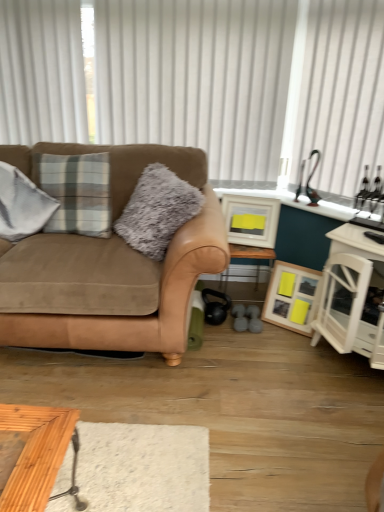
This screenshot has width=384, height=512. Describe the element at coordinates (157, 210) in the screenshot. I see `fuzzy gray pillow at center` at that location.

Measure the distance between point (270, 201) and camera.

The distance of point (270, 201) from camera is 2.45 meters.

Identify the location of matte white picture frame at center, arranged as the first picture frame when viewed from the top. (251, 220).

Describe the element at coordinates (350, 297) in the screenshot. Image resolution: width=384 pixels, height=512 pixels. I see `white wood cabinet at right` at that location.

The width and height of the screenshot is (384, 512). Identify the location of white vertical blinds at upper center, which is the 2th curtain in right-to-left order. (196, 78).

Can you confirm if suede brown couch at left is positioned to the right of matte white picture frame at center, arranged as the second picture frame when ordered from the bottom?

No.

Is the depth of suede brown couch at left greater than that of matte white picture frame at center, arranged as the second picture frame when ordered from the bottom?

That is False.

Considering the relative sizes of suede brown couch at left and matte white picture frame at center, arranged as the second picture frame when ordered from the bottom, in the image provided, is suede brown couch at left shorter than matte white picture frame at center, arranged as the second picture frame when ordered from the bottom,?

Incorrect, the height of suede brown couch at left does not fall short of that of matte white picture frame at center, arranged as the second picture frame when ordered from the bottom.

Between point (152, 290) and point (250, 199), which one is positioned in front?

Positioned in front is point (152, 290).

Between fuzzy gray pillow at center and wooden table at center, which one has larger size?

fuzzy gray pillow at center.

From the image's perspective, is fuzzy gray pillow at center located above or below wooden table at center?

Clearly, from the image's perspective, fuzzy gray pillow at center is above wooden table at center.

From the picture: Considering the relative positions of fuzzy gray pillow at center and wooden table at center in the image provided, is fuzzy gray pillow at center to the left of wooden table at center from the viewer's perspective?

Indeed, fuzzy gray pillow at center is positioned on the left side of wooden table at center.

In the scene shown: Is fuzzy gray pillow at center oriented away from wooden table at center?

Yes, wooden table at center is at the back of fuzzy gray pillow at center.

Looking at this image, does wooden table at center have a lesser width compared to white vertical blinds at upper center, which is the 2th curtain in right-to-left order?

Incorrect, the width of wooden table at center is not less than that of white vertical blinds at upper center, which is the 2th curtain in right-to-left order.

From a real-world perspective, is wooden table at center above or below white vertical blinds at upper center, which appears as the first curtain when viewed from the left?

Clearly, from a real-world perspective, wooden table at center is below white vertical blinds at upper center, which appears as the first curtain when viewed from the left.

Between wooden table at center and white vertical blinds at upper center, which is the 2th curtain in right-to-left order, which one has smaller size?

wooden table at center.

What's the angular difference between wooden table at center and white vertical blinds at upper center, which appears as the first curtain when viewed from the left,'s facing directions?

2.52 degrees.

From the image's perspective, count 1st curtains upward from the matte white picture frame at center, arranged as the first picture frame when viewed from the top, and point to it. Please provide its 2D coordinates.

[(342, 94)]

From the image's perspective, relative to matte white picture frame at center, arranged as the first picture frame when viewed from the top, is white sheer curtain at upper right, marked as the second curtain in a left-to-right arrangement, above or below?

Based on their image positions, white sheer curtain at upper right, marked as the second curtain in a left-to-right arrangement, is located above matte white picture frame at center, arranged as the first picture frame when viewed from the top.

Measure the distance from white sheer curtain at upper right, the first curtain when ordered from right to left, to matte white picture frame at center, arranged as the first picture frame when viewed from the top.

A distance of 24.11 inches exists between white sheer curtain at upper right, the first curtain when ordered from right to left, and matte white picture frame at center, arranged as the first picture frame when viewed from the top.

How different are the orientations of white sheer curtain at upper right, marked as the second curtain in a left-to-right arrangement, and matte white picture frame at center, arranged as the first picture frame when viewed from the top, in degrees?

There is a 30.8-degree angle between the facing directions of white sheer curtain at upper right, marked as the second curtain in a left-to-right arrangement, and matte white picture frame at center, arranged as the first picture frame when viewed from the top.

From a real-world perspective, between matte white picture frame at center, arranged as the second picture frame when ordered from the bottom, and wooden picture frame at lower right, which ranks as the second picture frame in top-to-bottom order, who is vertically lower?

In real-world perspective, wooden picture frame at lower right, which ranks as the second picture frame in top-to-bottom order, is lower.

From the image's perspective, does matte white picture frame at center, arranged as the first picture frame when viewed from the top, appear higher than wooden picture frame at lower right, which is counted as the 1th picture frame, starting from the bottom?

Indeed, from the image's perspective, matte white picture frame at center, arranged as the first picture frame when viewed from the top, is shown above wooden picture frame at lower right, which is counted as the 1th picture frame, starting from the bottom.

Is matte white picture frame at center, arranged as the second picture frame when ordered from the bottom, bigger or smaller than wooden picture frame at lower right, which is counted as the 1th picture frame, starting from the bottom?

matte white picture frame at center, arranged as the second picture frame when ordered from the bottom, is smaller than wooden picture frame at lower right, which is counted as the 1th picture frame, starting from the bottom.

Which object is positioned more to the right, matte white picture frame at center, arranged as the second picture frame when ordered from the bottom, or wooden picture frame at lower right, which is counted as the 1th picture frame, starting from the bottom?

wooden picture frame at lower right, which is counted as the 1th picture frame, starting from the bottom.

From a real-world perspective, does matte white picture frame at center, arranged as the second picture frame when ordered from the bottom, sit lower than fuzzy gray pillow at center?

Indeed, from a real-world perspective, matte white picture frame at center, arranged as the second picture frame when ordered from the bottom, is positioned beneath fuzzy gray pillow at center.

Considering the relative positions of matte white picture frame at center, arranged as the second picture frame when ordered from the bottom, and fuzzy gray pillow at center in the image provided, is matte white picture frame at center, arranged as the second picture frame when ordered from the bottom, to the right of fuzzy gray pillow at center from the viewer's perspective?

Yes, matte white picture frame at center, arranged as the second picture frame when ordered from the bottom, is to the right of fuzzy gray pillow at center.

Considering the relative sizes of matte white picture frame at center, arranged as the first picture frame when viewed from the top, and fuzzy gray pillow at center in the image provided, is matte white picture frame at center, arranged as the first picture frame when viewed from the top, wider than fuzzy gray pillow at center?

Incorrect, the width of matte white picture frame at center, arranged as the first picture frame when viewed from the top, does not surpass that of fuzzy gray pillow at center.

Does matte white picture frame at center, arranged as the first picture frame when viewed from the top, contain fuzzy gray pillow at center?

No, fuzzy gray pillow at center is not surrounded by matte white picture frame at center, arranged as the first picture frame when viewed from the top.

Does fuzzy gray pillow at center have a greater height compared to wooden picture frame at lower right, which is counted as the 1th picture frame, starting from the bottom?

Yes, fuzzy gray pillow at center is taller than wooden picture frame at lower right, which is counted as the 1th picture frame, starting from the bottom.

Which of these two, fuzzy gray pillow at center or wooden picture frame at lower right, which is counted as the 1th picture frame, starting from the bottom, is wider?

Wider between the two is fuzzy gray pillow at center.

From a real-world perspective, who is located higher, fuzzy gray pillow at center or wooden picture frame at lower right, which is counted as the 1th picture frame, starting from the bottom?

fuzzy gray pillow at center.

Considering the positions of point (177, 202) and point (295, 319), is point (177, 202) closer or farther from the camera than point (295, 319)?

Point (177, 202).

Locate an element on the screen. studio couch that is below the matte white picture frame at center, arranged as the first picture frame when viewed from the top (from the image's perspective) is located at coordinates (109, 267).

Locate an element on the screen. The width and height of the screenshot is (384, 512). table that is on the right side of fuzzy gray pillow at center is located at coordinates (253, 256).

Which object lies nearer to the anchor point white vertical blinds at upper center, which is the 2th curtain in right-to-left order, wooden table at center or matte white picture frame at center, arranged as the second picture frame when ordered from the bottom?

The object closer to white vertical blinds at upper center, which is the 2th curtain in right-to-left order, is matte white picture frame at center, arranged as the second picture frame when ordered from the bottom.

Estimate the real-world distances between objects in this image. Which object is further from wooden picture frame at lower right, which ranks as the second picture frame in top-to-bottom order, white wood cabinet at right or white vertical blinds at upper center, which appears as the first curtain when viewed from the left?

Based on the image, white vertical blinds at upper center, which appears as the first curtain when viewed from the left, appears to be further to wooden picture frame at lower right, which ranks as the second picture frame in top-to-bottom order.

Estimate the real-world distances between objects in this image. Which object is closer to white sheer curtain at upper right, the first curtain when ordered from right to left, white vertical blinds at upper center, which is the 2th curtain in right-to-left order, or suede brown couch at left?

white vertical blinds at upper center, which is the 2th curtain in right-to-left order, is positioned closer to the anchor white sheer curtain at upper right, the first curtain when ordered from right to left.

When comparing their distances from matte white picture frame at center, arranged as the second picture frame when ordered from the bottom, does fuzzy gray pillow at center or white vertical blinds at upper center, which is the 2th curtain in right-to-left order, seem closer?

The object closer to matte white picture frame at center, arranged as the second picture frame when ordered from the bottom, is fuzzy gray pillow at center.

When comparing their distances from white vertical blinds at upper center, which appears as the first curtain when viewed from the left, does white sheer curtain at upper right, marked as the second curtain in a left-to-right arrangement, or white wood cabinet at right seem closer?

The object closer to white vertical blinds at upper center, which appears as the first curtain when viewed from the left, is white sheer curtain at upper right, marked as the second curtain in a left-to-right arrangement.

Considering their positions, is wooden picture frame at lower right, which is counted as the 1th picture frame, starting from the bottom, positioned further to suede brown couch at left than matte white picture frame at center, arranged as the first picture frame when viewed from the top?

Based on the image, wooden picture frame at lower right, which is counted as the 1th picture frame, starting from the bottom, appears to be further to suede brown couch at left.

From the picture: Considering their positions, is white wood cabinet at right positioned closer to wooden table at center than matte white picture frame at center, arranged as the second picture frame when ordered from the bottom?

Among the two, matte white picture frame at center, arranged as the second picture frame when ordered from the bottom, is located nearer to wooden table at center.

When comparing their distances from white vertical blinds at upper center, which is the 2th curtain in right-to-left order, does matte white picture frame at center, arranged as the second picture frame when ordered from the bottom, or wooden picture frame at lower right, which is counted as the 1th picture frame, starting from the bottom, seem further?

The object further to white vertical blinds at upper center, which is the 2th curtain in right-to-left order, is wooden picture frame at lower right, which is counted as the 1th picture frame, starting from the bottom.

This screenshot has width=384, height=512. I want to click on pillow between white vertical blinds at upper center, which appears as the first curtain when viewed from the left, and matte white picture frame at center, arranged as the second picture frame when ordered from the bottom, in the vertical direction, so click(157, 210).

This screenshot has height=512, width=384. Identify the location of curtain between fuzzy gray pillow at center and white wood cabinet at right in the horizontal direction. (342, 94).

What are the coordinates of `table between white vertical blinds at upper center, which is the 2th curtain in right-to-left order, and white wood cabinet at right in the up-down direction` in the screenshot? It's located at (253, 256).

I want to click on curtain situated between white vertical blinds at upper center, which appears as the first curtain when viewed from the left, and white wood cabinet at right from left to right, so click(x=342, y=94).